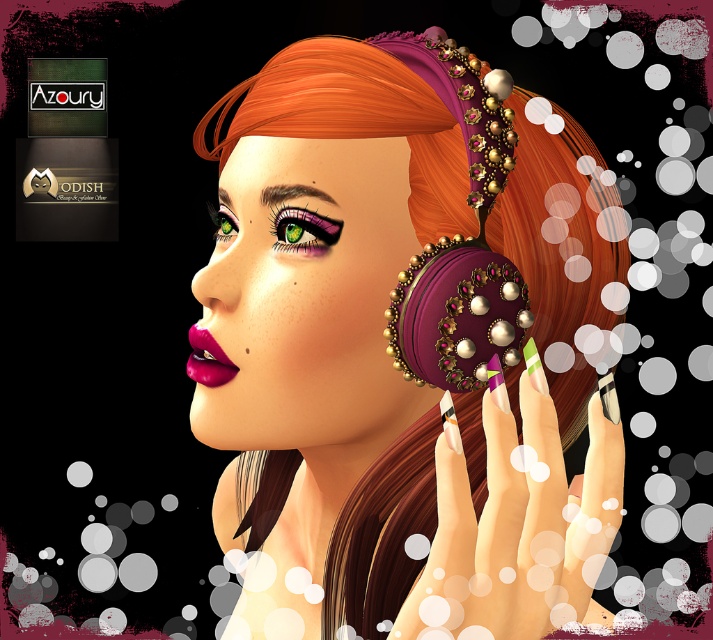
Looking at this image, you are a makeup artist preparing to replicate this look. You have a limited space on your palette. Which object, the matte purple earring at center or the matte pink lipstick at lower left, requires more space due to its size?

The matte purple earring at center requires more space because its width is larger than the matte pink lipstick at lower left.

You are an artist analyzing the composition of this portrait. You notice two points marked on the image at coordinates point (x=426, y=605) and point (x=188, y=371). Which point appears closer to the viewer in the portrait?

Point (x=426, y=605) is in front of point (x=188, y=371), so it appears closer to the viewer.

In the scene shown: You are an artist trying to replicate the portrait. You need to place the matte purple earring at center and the nail polish at center accurately. According to the image, which one is located to the left?

The matte purple earring at center is positioned on the left side of nail polish at center, so the matte purple earring at center is located to the left.